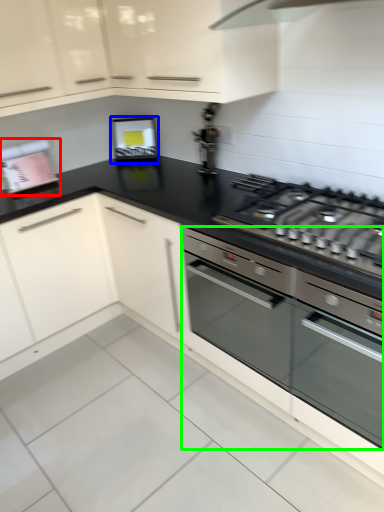
Question: Based on their relative distances, which object is nearer to appliance (highlighted by a red box)? Choose from appliance (highlighted by a blue box) and home appliance (highlighted by a green box).

Choices:
 (A) appliance
 (B) home appliance

Answer: (A)